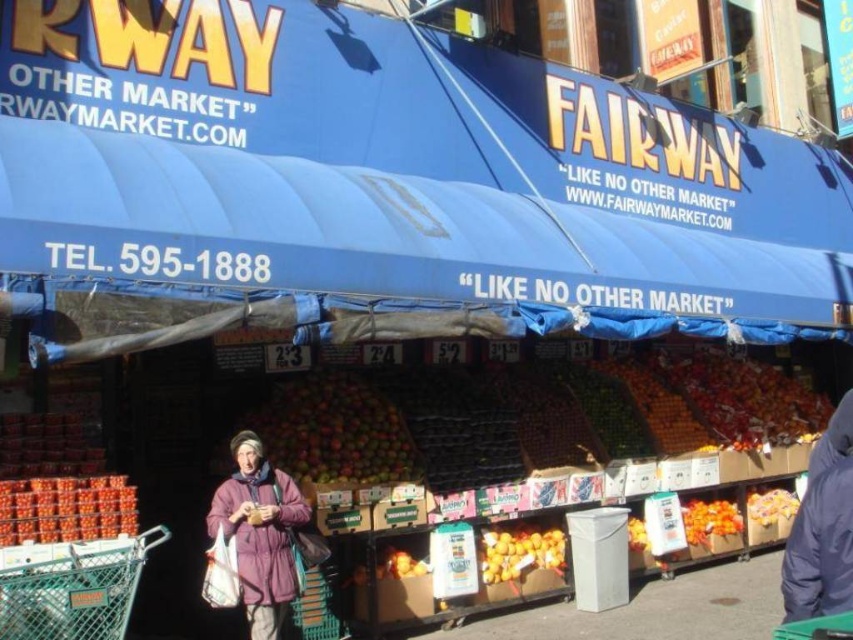
Question: Is the position of shiny red tomatoes at lower left more distant than that of orange matte fruit at center?

Choices:
 (A) no
 (B) yes

Answer: (A)

Question: From the image, what is the correct spatial relationship of shiny red apples at center in relation to shiny red tomatoes at lower left?

Choices:
 (A) left
 (B) right

Answer: (B)

Question: Which of these objects is positioned farthest from the shiny red tomatoes at lower left?

Choices:
 (A) purple woolen coat at lower left
 (B) orange matte fruit at center

Answer: (B)

Question: From the image, what is the correct spatial relationship of green wire shopping cart at lower left in relation to orange matte fruit at center?

Choices:
 (A) right
 (B) left

Answer: (B)

Question: Among these objects, which one is farthest from the camera?

Choices:
 (A) green wire shopping cart at lower left
 (B) purple woolen coat at lower left
 (C) shiny red apples at center
 (D) shiny red tomatoes at lower left

Answer: (C)

Question: Which point is farther to the camera?

Choices:
 (A) (833, 483)
 (B) (410, 460)
 (C) (306, 520)
 (D) (3, 593)

Answer: (B)